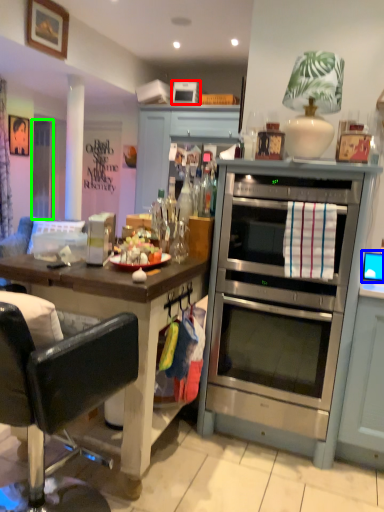
Question: Which object is positioned closest to appliance (highlighted by a red box)? Select from computer monitor (highlighted by a blue box) and glass door (highlighted by a green box).

Choices:
 (A) computer monitor
 (B) glass door

Answer: (B)